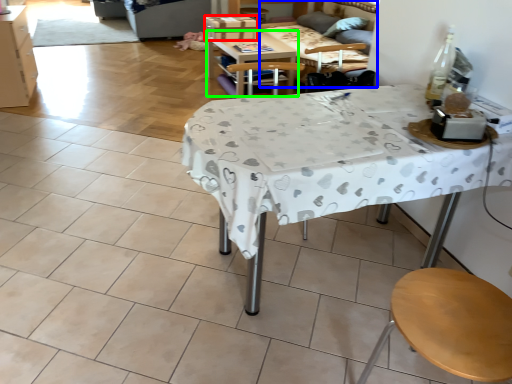
Question: Which object is the closest to the box (highlighted by a red box)? Choose among these: couch (highlighted by a blue box) or table (highlighted by a green box).

Choices:
 (A) couch
 (B) table

Answer: (B)